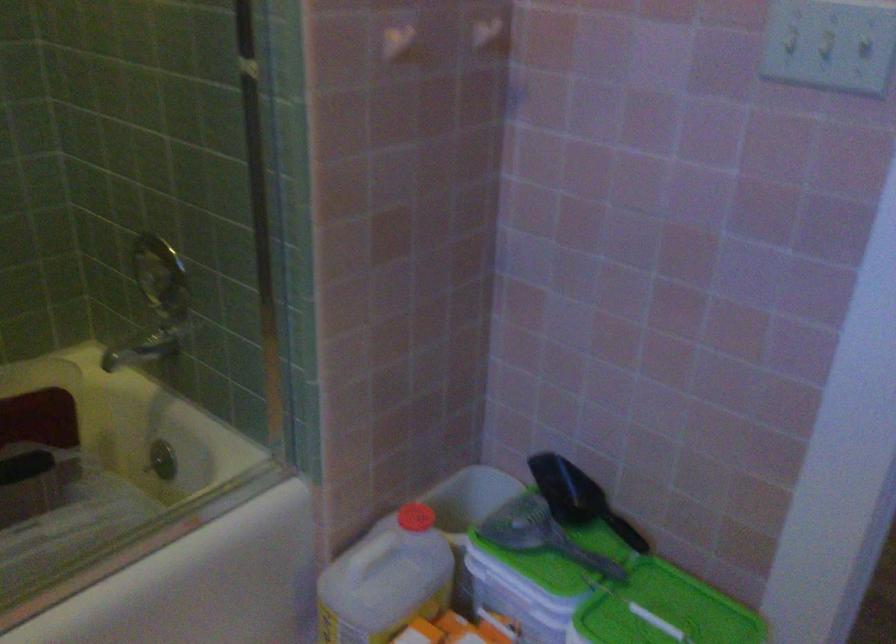
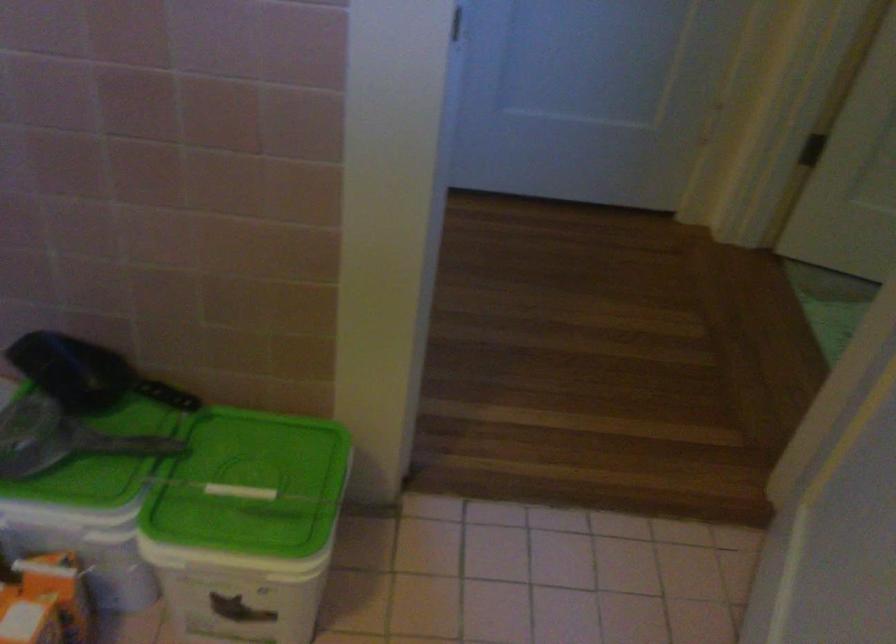
In the second image, find the point that corresponds to the point at 571,494 in the first image.

(85, 374)